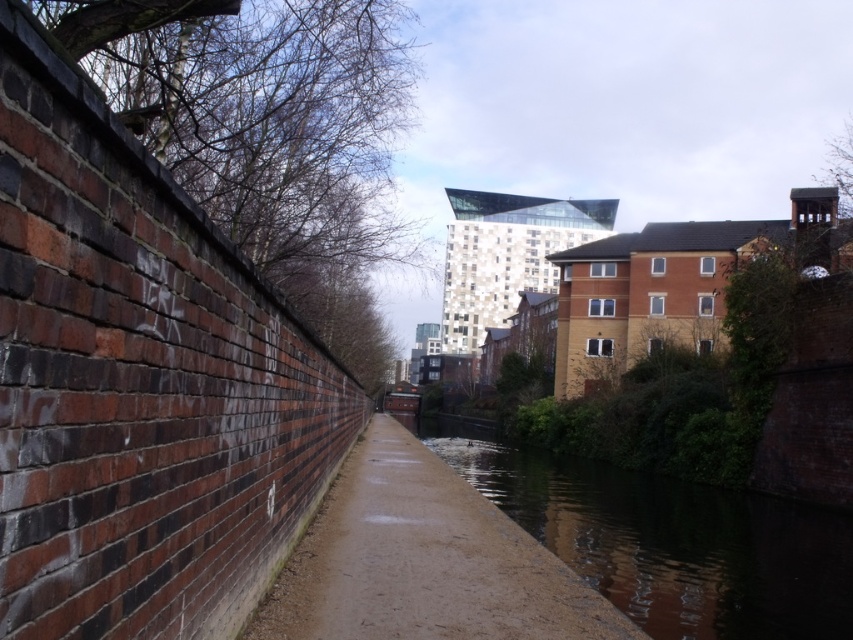
You are standing on the paved path next to the brick wall and want to reach the point marked as point (668,541). According to the scene description, where is this point located?

The point (668,541) is on the dark reflective water at center.